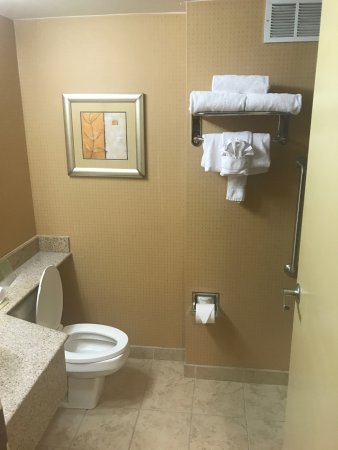
At what (x,y) coordinates should I click in order to perform the action: click on safety rail. Please return your answer as a coordinate pair (x, y). Looking at the image, I should click on (298, 218).